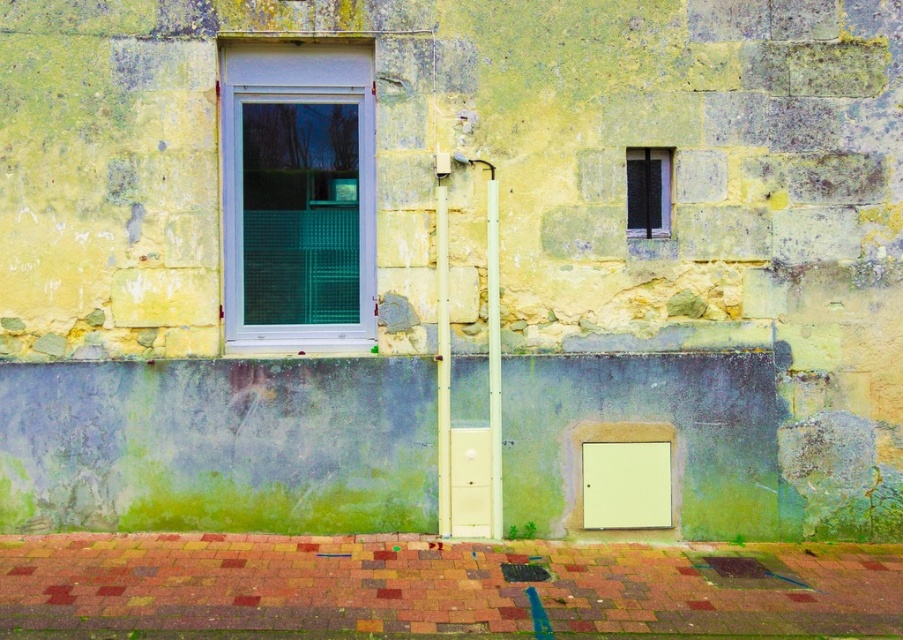
Question: Can you confirm if white plastic window at center is positioned below white plastic pipe at center?

Choices:
 (A) yes
 (B) no

Answer: (B)

Question: Can you confirm if white plastic window at center is wider than white plastic pipe at center?

Choices:
 (A) yes
 (B) no

Answer: (A)

Question: Does white plastic window at center have a greater width compared to white plastic pipe at center?

Choices:
 (A) no
 (B) yes

Answer: (B)

Question: Among these objects, which one is nearest to the camera?

Choices:
 (A) white plastic pipe at center
 (B) white plastic window at center
 (C) white plastic pole at center
 (D) black metal window at upper right

Answer: (C)

Question: Considering the real-world distances, which object is closest to the white plastic pole at center?

Choices:
 (A) black metal window at upper right
 (B) white plastic window at center
 (C) white plastic pipe at center

Answer: (C)

Question: Based on their relative distances, which object is nearer to the black metal window at upper right?

Choices:
 (A) white plastic pipe at center
 (B) white plastic window at center
 (C) white plastic pole at center

Answer: (A)